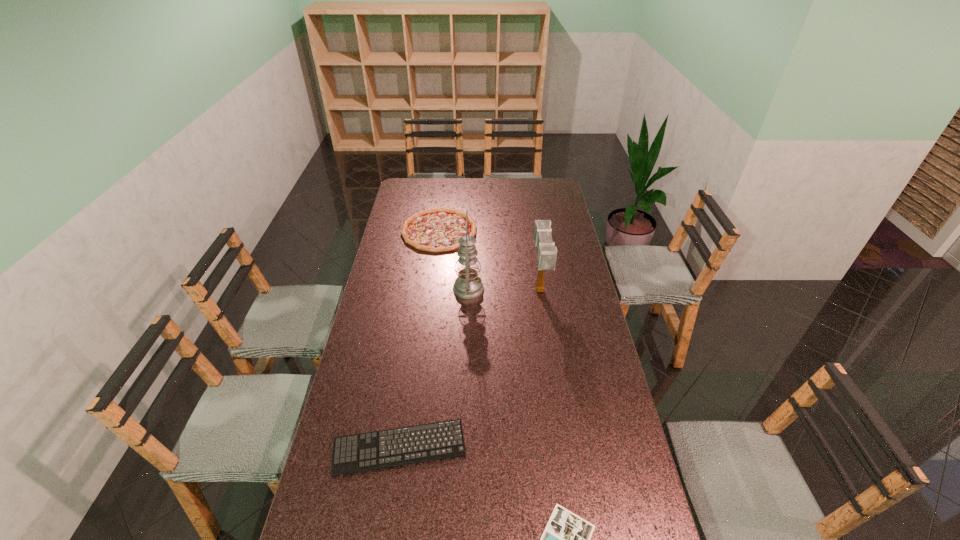
The image size is (960, 540). In order to click on pizza positioned at the left edge in this screenshot , I will do `click(438, 229)`.

The height and width of the screenshot is (540, 960). In order to click on computer keyboard that is positioned at the left edge in this screenshot , I will do `click(377, 441)`.

At what (x,y) coordinates should I click in order to perform the action: click on free space at the far edge of the desktop. Please return your answer as a coordinate pair (x, y). The height and width of the screenshot is (540, 960). Looking at the image, I should click on point(481,188).

You are a GUI agent. You are given a task and a screenshot of the screen. Output one action in this format:
    pyautogui.click(x=<x>, y=<y>)
    Task: Click on the free space at the left edge
    
    Given the screenshot: What is the action you would take?
    pyautogui.click(x=422, y=202)

Where is `free location at the right edge`? Image resolution: width=960 pixels, height=540 pixels. free location at the right edge is located at coordinates (619, 458).

In the image, there is a desktop. Where is `free space at the far left corner`? This screenshot has height=540, width=960. free space at the far left corner is located at coordinates (406, 199).

Find the location of `free point between the fourth shortest object and the third tallest object`. free point between the fourth shortest object and the third tallest object is located at coordinates (490, 261).

In order to click on free area in between the farthest object and the tallest object in this screenshot , I will do `click(454, 260)`.

Locate an element on the screen. Image resolution: width=960 pixels, height=540 pixels. free spot between the oil lamp and the third tallest object is located at coordinates (454, 260).

What are the coordinates of `vacant space that is in between the second nearest object and the oil lamp` in the screenshot? It's located at (434, 368).